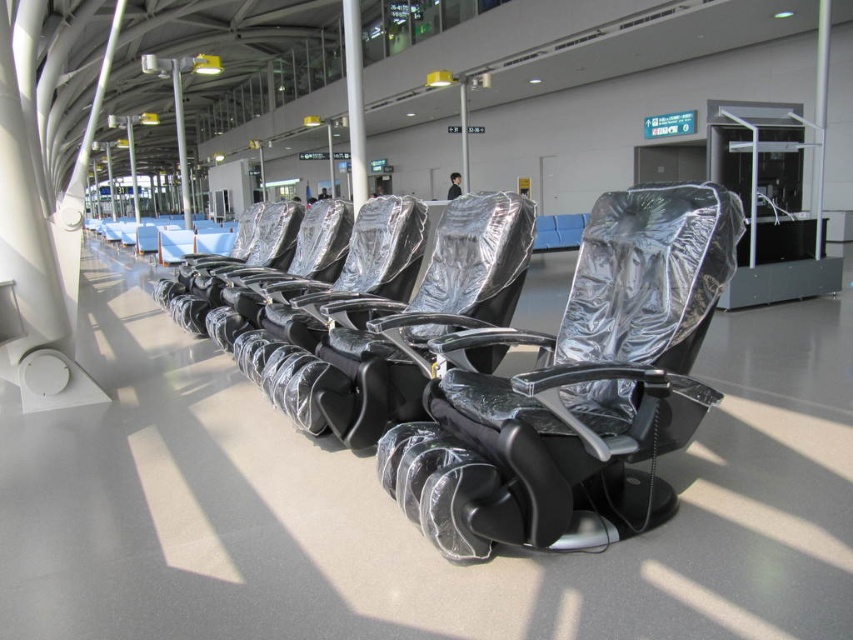
Can you confirm if shiny black leather chair at center is wider than shiny metallic seat at center?

Indeed, shiny black leather chair at center has a greater width compared to shiny metallic seat at center.

Describe the element at coordinates (576, 388) in the screenshot. This screenshot has width=853, height=640. I see `shiny black leather chair at center` at that location.

Find the location of a particular element. shiny black leather chair at center is located at coordinates 576,388.

Which is above, shiny metallic seat at center or metallic silver chair at center?

metallic silver chair at center

Looking at this image, which is more to the left, shiny metallic seat at center or metallic silver chair at center?

metallic silver chair at center

Find the location of a particular element. This screenshot has height=640, width=853. shiny metallic seat at center is located at coordinates (422, 317).

Image resolution: width=853 pixels, height=640 pixels. Find the location of `shiny metallic seat at center`. shiny metallic seat at center is located at coordinates (422, 317).

Which is more to the left, shiny black leather chair at center or metallic silver chair at center?

metallic silver chair at center is more to the left.

Between point (576, 266) and point (323, 284), which one is positioned in front?

Point (576, 266)

I want to click on shiny black leather chair at center, so click(576, 388).